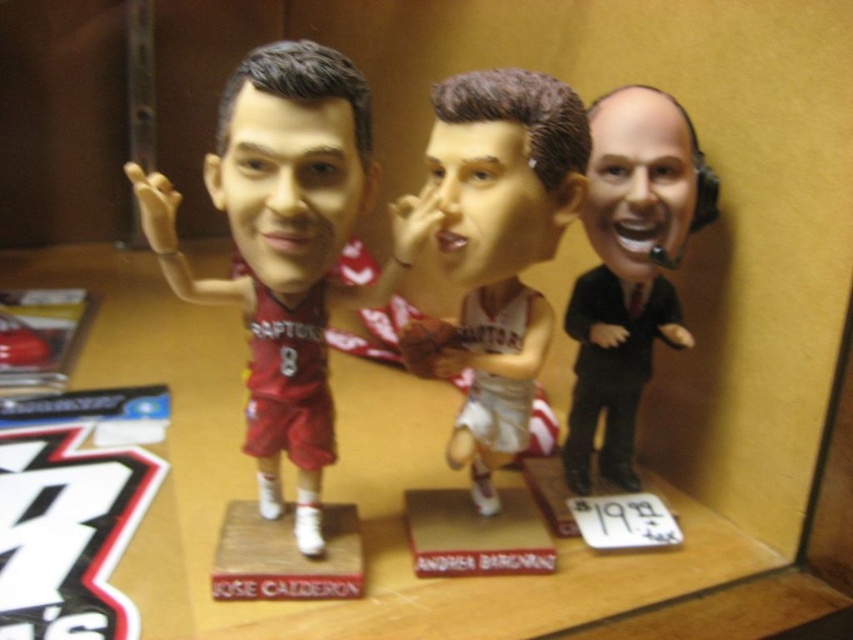
You are an interior designer arranging a display case. You have two items to place in the case, the matte plastic bobblehead at center and the black suit at right. Given their sizes, which item should be placed in the front to ensure both are visible?

The matte plastic bobblehead at center is larger in size than the black suit at right, so placing the smaller black suit at right in front would allow both items to be visible without obstruction.

You are a store employee who needs to arrange the display case items properly. The matte plastic bobblehead at center and the black suit at right are currently misplaced. According to the store policy, all items must be arranged from top to bottom in order of their height. Which item should be placed above the other?

The black suit at right should be placed above the matte plastic bobblehead at center because the matte plastic bobblehead at center is currently located below it, indicating it is shorter in height.

You are a customer in a gift shop and see the matte plastic bobblehead at center and the black suit at right displayed in a case. Which item is closer to the left side of the display case?

The matte plastic bobblehead at center is positioned on the left side of the black suit at right, so it is closer to the left side of the display case.